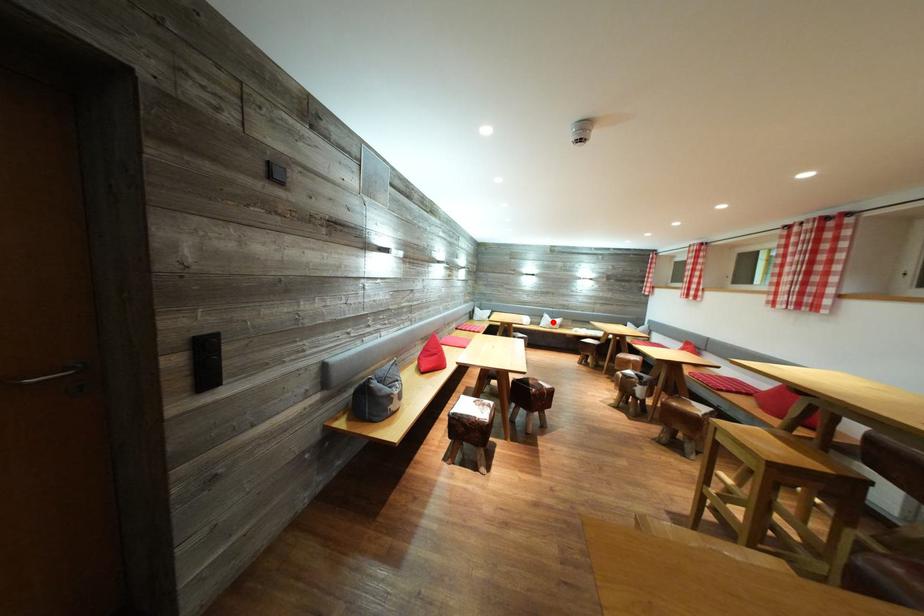
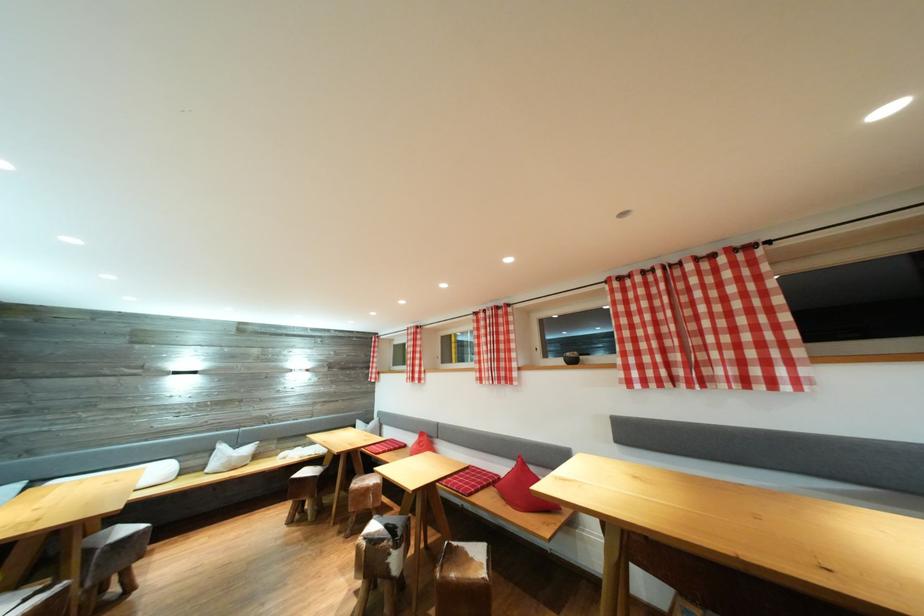
Locate, in the second image, the point that corresponds to the highlighted location in the first image.

(228, 453)